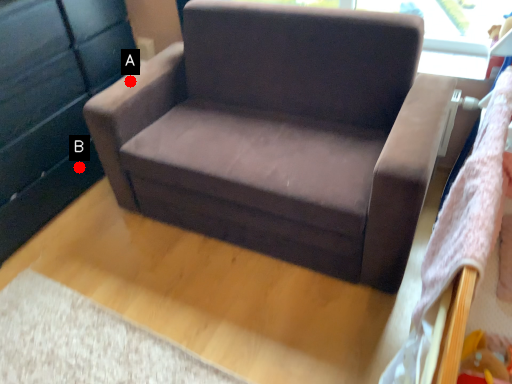
Question: Two points are circled on the image, labeled by A and B beside each circle. Which point is farther to the camera?

Choices:
 (A) A is further
 (B) B is further

Answer: (B)